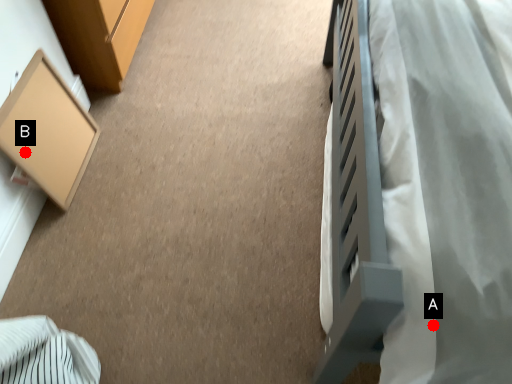
Question: Two points are circled on the image, labeled by A and B beside each circle. Which point is further to the camera?

Choices:
 (A) A is further
 (B) B is further

Answer: (B)